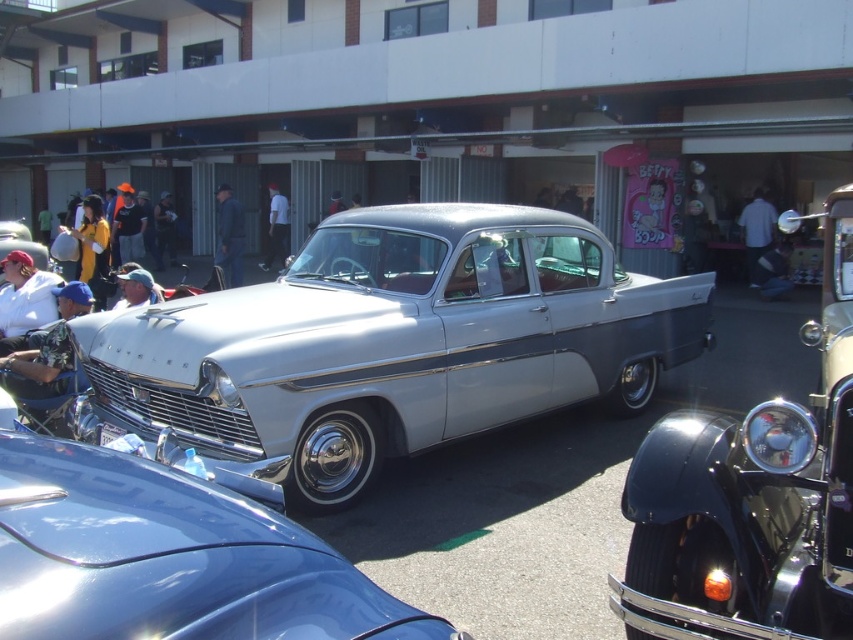
Is white fabric shirt at center below matte silver pickup truck at center?

Indeed, white fabric shirt at center is positioned under matte silver pickup truck at center.

Who is positioned more to the left, white fabric shirt at center or matte silver pickup truck at center?

From the viewer's perspective, matte silver pickup truck at center appears more on the left side.

Is point (759, 218) positioned in front of point (18, 234)?

That is False.

Identify the location of white fabric shirt at center. (756, 230).

Where is `white cotton shirt at center`? white cotton shirt at center is located at coordinates (276, 227).

Is point (271, 232) in front of point (16, 236)?

No.

Is point (265, 237) positioned in front of point (39, 257)?

No.

You are a GUI agent. You are given a task and a screenshot of the screen. Output one action in this format:
    pyautogui.click(x=<x>, y=<y>)
    Task: Click on the white cotton shirt at center
    
    Given the screenshot: What is the action you would take?
    pyautogui.click(x=276, y=227)

Can you confirm if shiny chrome car at center is positioned to the left of silver metallic pickup truck at center?

Correct, you'll find shiny chrome car at center to the left of silver metallic pickup truck at center.

Is shiny chrome car at center below silver metallic pickup truck at center?

Actually, shiny chrome car at center is above silver metallic pickup truck at center.

The width and height of the screenshot is (853, 640). Find the location of `shiny chrome car at center`. shiny chrome car at center is located at coordinates (169, 557).